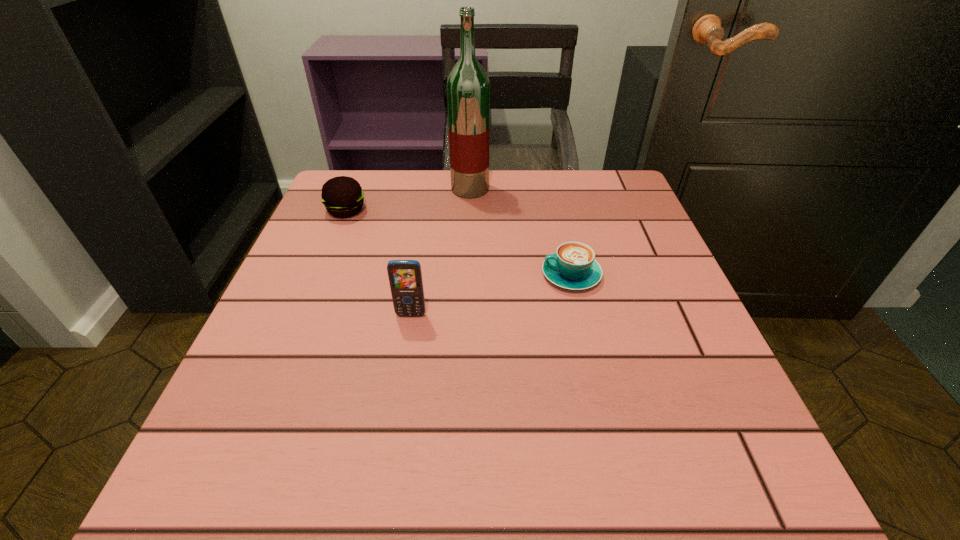
Identify the location of vacant space at the near edge. (452, 447).

Image resolution: width=960 pixels, height=540 pixels. I want to click on free space at the left edge of the desktop, so click(x=253, y=415).

Where is `free space at the right edge`? free space at the right edge is located at coordinates [710, 435].

You are a GUI agent. You are given a task and a screenshot of the screen. Output one action in this format:
    pyautogui.click(x=<x>, y=<y>)
    Task: Click on the vacant area at the far right corner
    
    Given the screenshot: What is the action you would take?
    click(617, 190)

In the image, there is a desktop. Find the location of `free space at the near right corner`. free space at the near right corner is located at coordinates click(747, 487).

Identify the location of vacant area that lies between the tallest object and the second tallest object. The image size is (960, 540). (441, 252).

I want to click on empty space between the farthest object and the second farthest object, so click(x=408, y=200).

The height and width of the screenshot is (540, 960). Find the location of `empty space between the second nearest object and the cellular telephone`. empty space between the second nearest object and the cellular telephone is located at coordinates (492, 295).

Identify the location of empty space between the tallest object and the leftmost object. The height and width of the screenshot is (540, 960). (408, 200).

Image resolution: width=960 pixels, height=540 pixels. What are the coordinates of `vacant region between the third object from right to left and the third farthest object` in the screenshot? It's located at (492, 295).